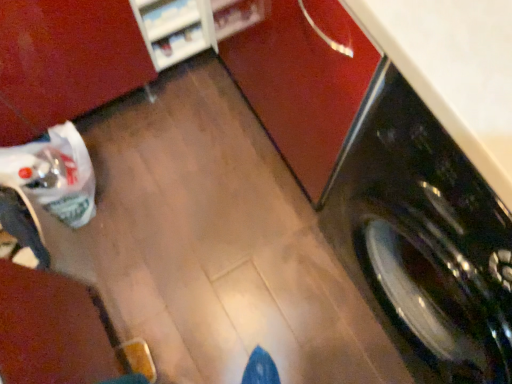
Question: Is white glossy shelf at upper left far away from black glossy washing machine at right?

Choices:
 (A) no
 (B) yes

Answer: (A)

Question: Considering the relative positions of white glossy shelf at upper left and black glossy washing machine at right in the image provided, is white glossy shelf at upper left to the right of black glossy washing machine at right from the viewer's perspective?

Choices:
 (A) yes
 (B) no

Answer: (B)

Question: From the image's perspective, would you say white glossy shelf at upper left is shown under black glossy washing machine at right?

Choices:
 (A) no
 (B) yes

Answer: (A)

Question: Can you confirm if white glossy shelf at upper left is smaller than black glossy washing machine at right?

Choices:
 (A) yes
 (B) no

Answer: (A)

Question: Is white glossy shelf at upper left bigger than black glossy washing machine at right?

Choices:
 (A) no
 (B) yes

Answer: (A)

Question: Is white glossy shelf at upper left aimed at black glossy washing machine at right?

Choices:
 (A) yes
 (B) no

Answer: (A)

Question: Can you confirm if black glossy washing machine at right is taller than white glossy shelf at upper left?

Choices:
 (A) no
 (B) yes

Answer: (B)

Question: Can we say black glossy washing machine at right lies outside white glossy shelf at upper left?

Choices:
 (A) yes
 (B) no

Answer: (A)

Question: Is black glossy washing machine at right far away from white glossy shelf at upper left?

Choices:
 (A) yes
 (B) no

Answer: (B)

Question: Is black glossy washing machine at right next to white glossy shelf at upper left and touching it?

Choices:
 (A) no
 (B) yes

Answer: (A)

Question: Is black glossy washing machine at right facing towards white glossy shelf at upper left?

Choices:
 (A) no
 (B) yes

Answer: (A)

Question: Does black glossy washing machine at right have a greater width compared to white glossy shelf at upper left?

Choices:
 (A) no
 (B) yes

Answer: (B)

Question: Is point (503, 230) closer or farther from the camera than point (172, 46)?

Choices:
 (A) farther
 (B) closer

Answer: (B)